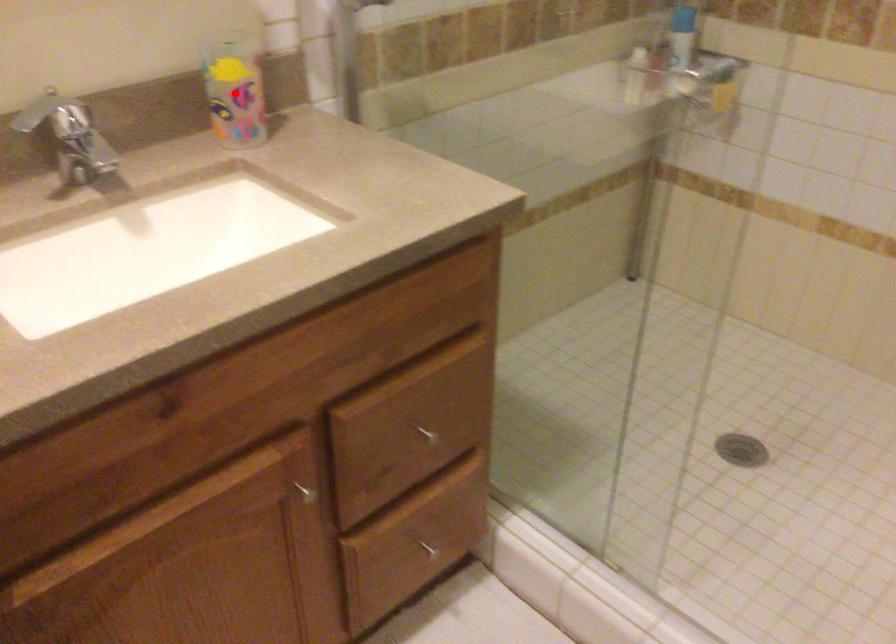
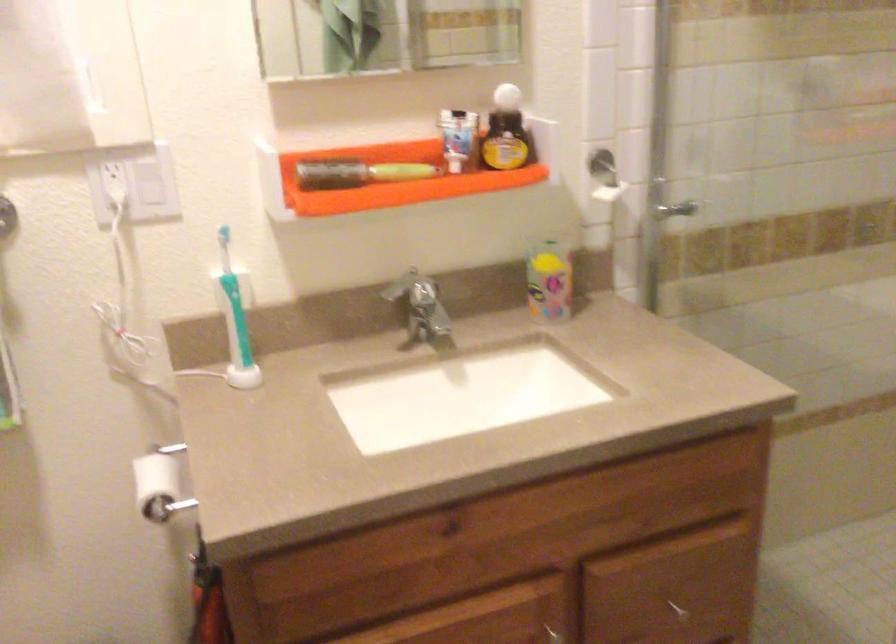
Find the pixel in the second image that matches the highlighted location in the first image.

(549, 279)